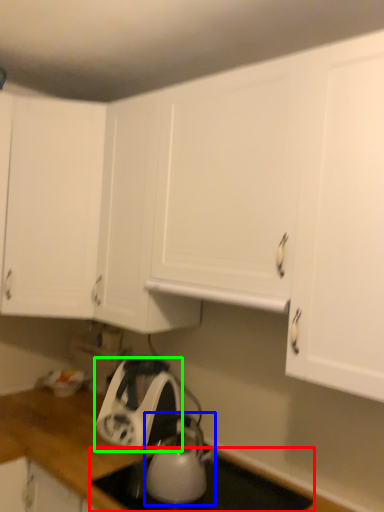
Question: Which object is the closest to the gas stove (highlighted by a red box)? Choose among these: kitchen appliance (highlighted by a blue box) or home appliance (highlighted by a green box).

Choices:
 (A) kitchen appliance
 (B) home appliance

Answer: (A)